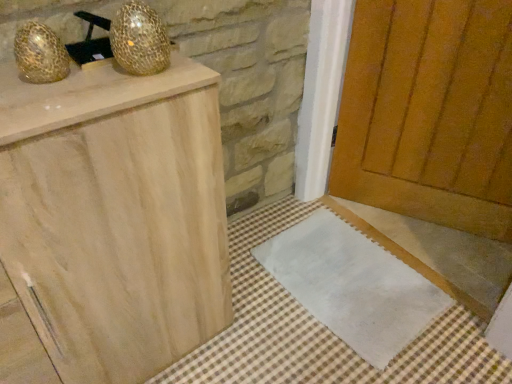
This screenshot has width=512, height=384. I want to click on free space on the front side of white fabric doormat at lower center, so [x=348, y=354].